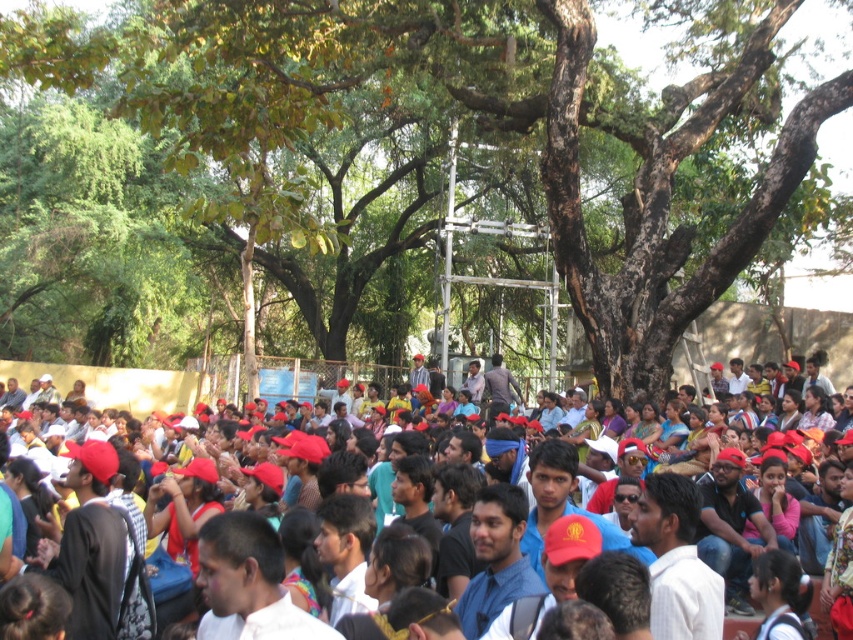
Who is higher up, brown rough tree at center or red matte cap at center?

Positioned higher is brown rough tree at center.

In the scene shown: Does brown rough tree at center have a larger size compared to red matte cap at center?

Yes.

Find the location of a particular element. brown rough tree at center is located at coordinates (467, 148).